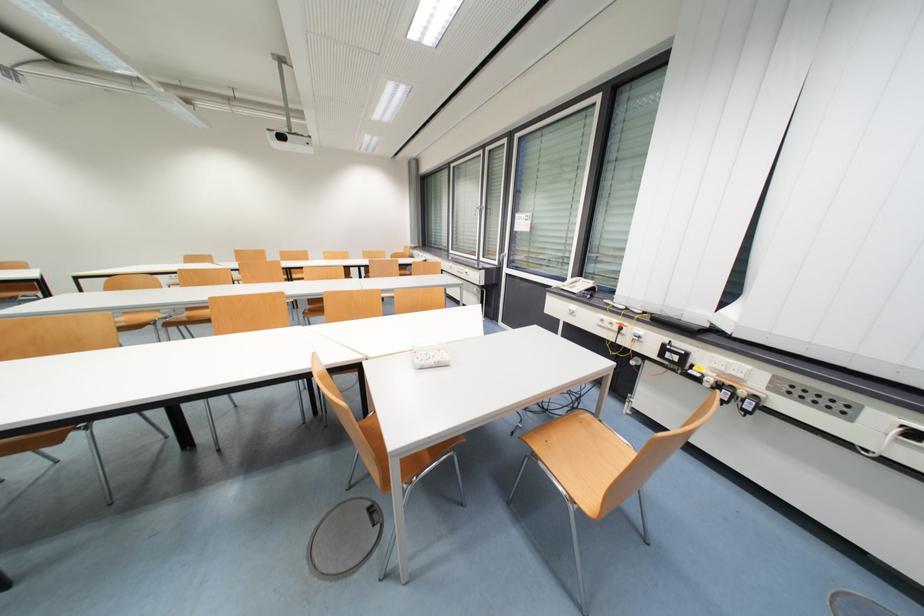
The width and height of the screenshot is (924, 616). Find the location of `black rotary knob`. black rotary knob is located at coordinates (581, 318).